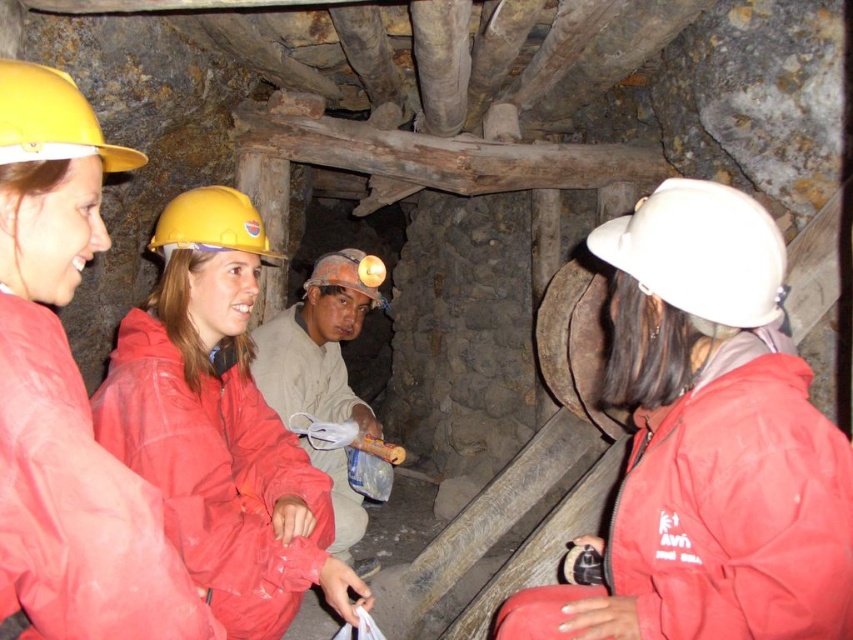
Based on the photo, you are a safety inspector in the mine. You notice the matte red jacket at center and the yellow matte helmet at center. Which object is positioned in front of the other from your viewpoint?

The matte red jacket at center is closer to the viewer than the yellow matte helmet at center, so the matte red jacket at center is positioned in front of the yellow matte helmet at center.

You are part of a rescue team entering this mine. You notice the matte red jacket at center and the yellow matte helmet at center. Based on their positions, which item is closer to the ground?

The matte red jacket at center is below the yellow matte helmet at center, so the matte red jacket at center is closer to the ground.